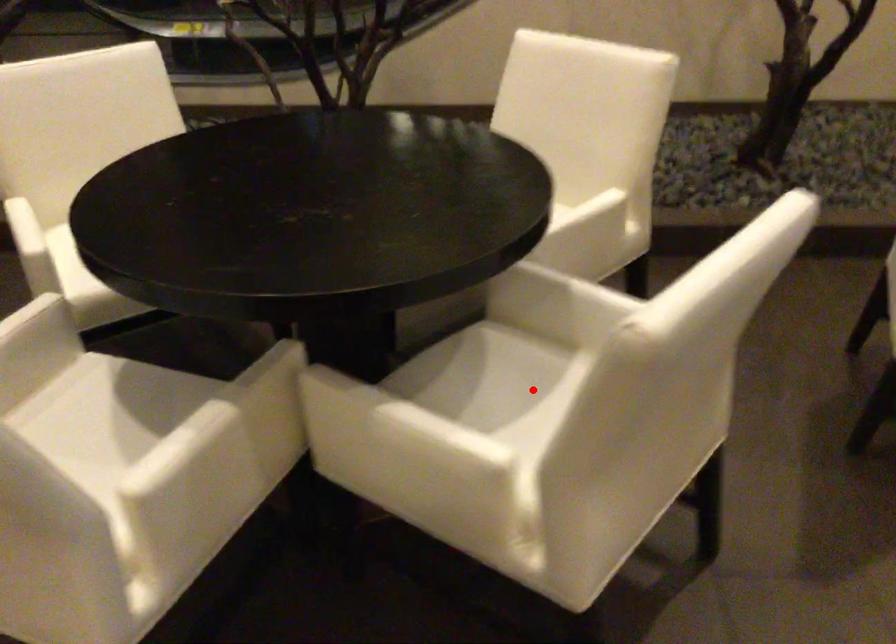
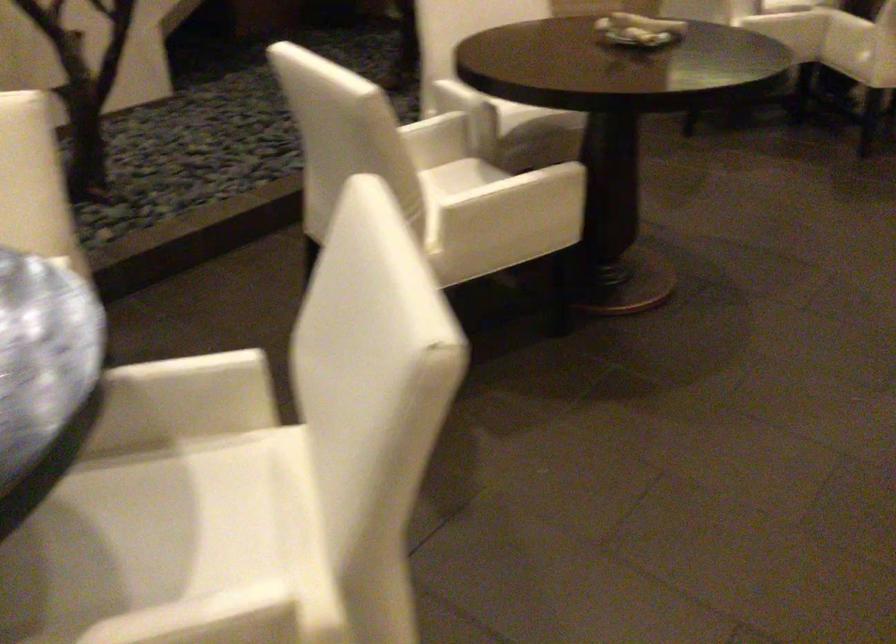
Question: A red point is marked in image1. In image2, is the corresponding 3D point closer to the camera or farther? Reply with the corresponding letter.

Choices:
 (A) The corresponding 3D point is closer.
 (B) The corresponding 3D point is farther.

Answer: (A)